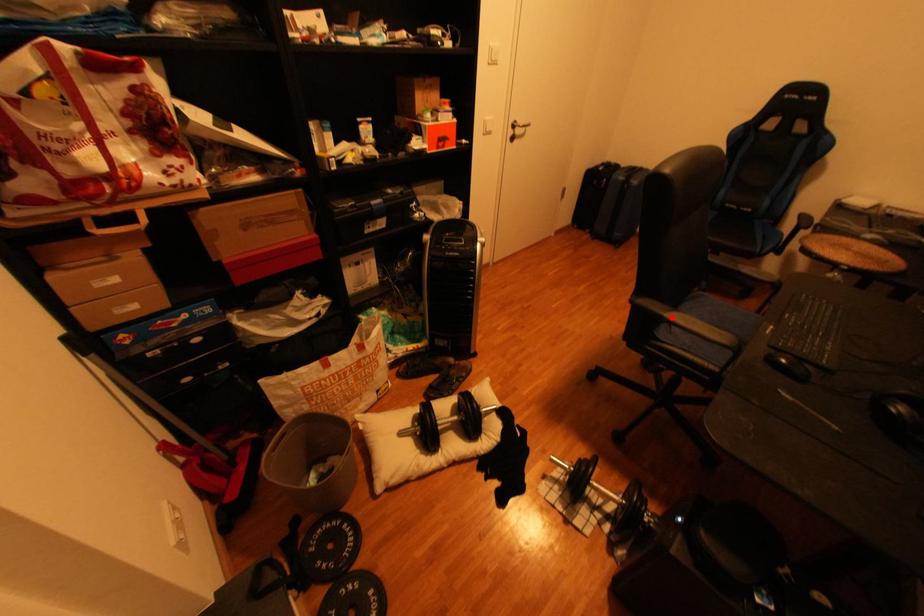
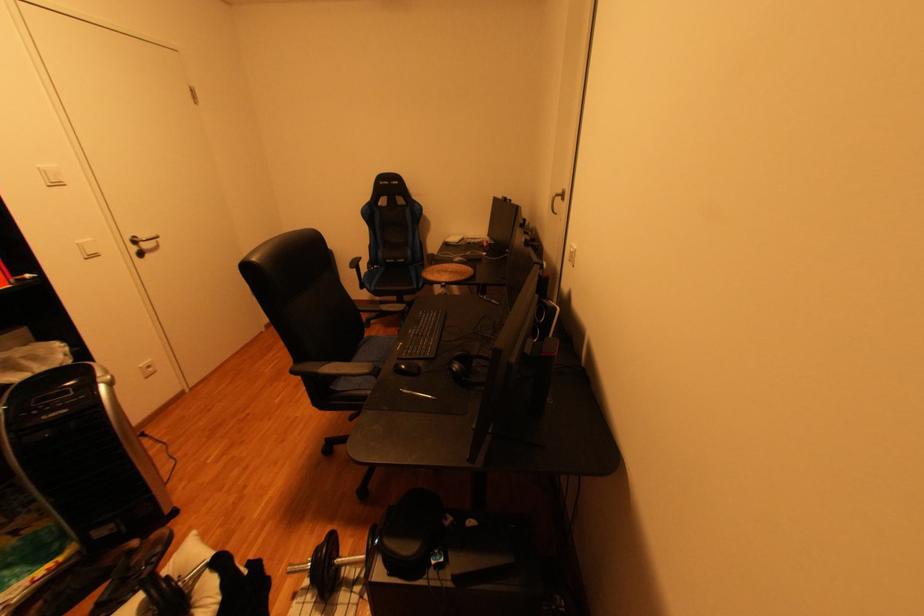
Locate, in the second image, the point that corresponds to the highlighted location in the first image.

(325, 375)